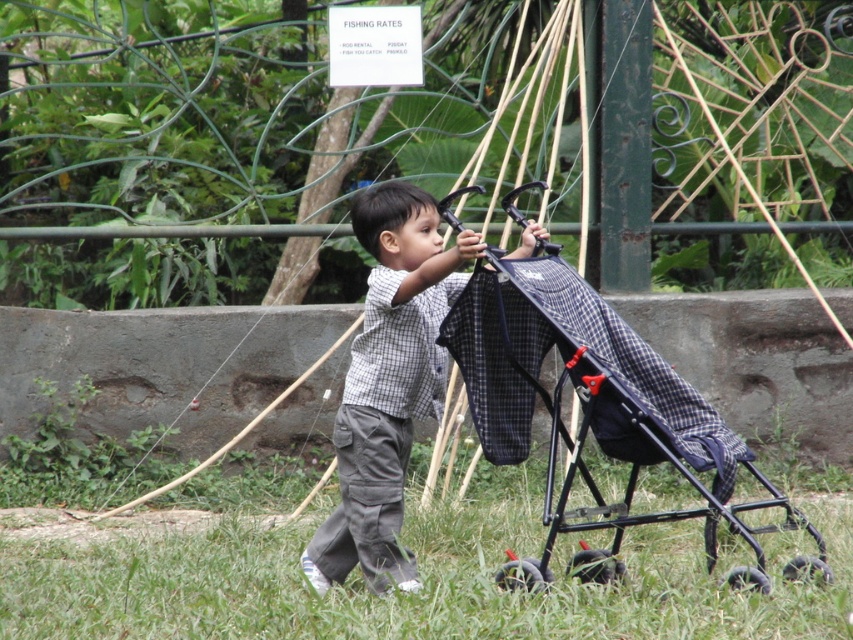
Does green grass at lower center have a greater width compared to plaid fabric stroller at center?

Indeed, green grass at lower center has a greater width compared to plaid fabric stroller at center.

Who is higher up, green grass at lower center or plaid fabric stroller at center?

plaid fabric stroller at center is higher up.

Measure the distance between green grass at lower center and camera.

green grass at lower center and camera are 4.04 meters apart from each other.

The image size is (853, 640). What are the coordinates of `green grass at lower center` in the screenshot? It's located at (422, 580).

Does green grass at lower center have a greater width compared to gray checkered shirt at center?

Correct, the width of green grass at lower center exceeds that of gray checkered shirt at center.

Consider the image. Does green grass at lower center have a greater height compared to gray checkered shirt at center?

No, green grass at lower center is not taller than gray checkered shirt at center.

Between point (405, 536) and point (354, 356), which one is positioned behind?

Point (405, 536)

Where is `green grass at lower center`? This screenshot has height=640, width=853. green grass at lower center is located at coordinates (422, 580).

Find the location of a particular element. The height and width of the screenshot is (640, 853). plaid fabric stroller at center is located at coordinates (595, 410).

Is plaid fabric stroller at center thinner than gray checkered shirt at center?

No.

Which is in front, point (531, 305) or point (437, 362)?

Point (531, 305)

Locate an element on the screen. plaid fabric stroller at center is located at coordinates (595, 410).